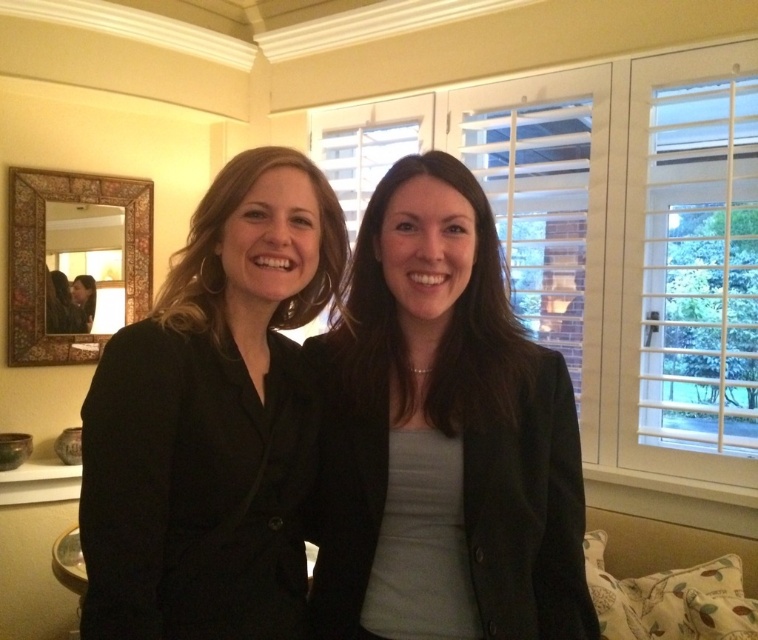
Can you confirm if black matte blazer at left is shorter than matte black blazer at center?

Incorrect, black matte blazer at left's height does not fall short of matte black blazer at center's.

The width and height of the screenshot is (758, 640). I want to click on black matte blazer at left, so click(211, 419).